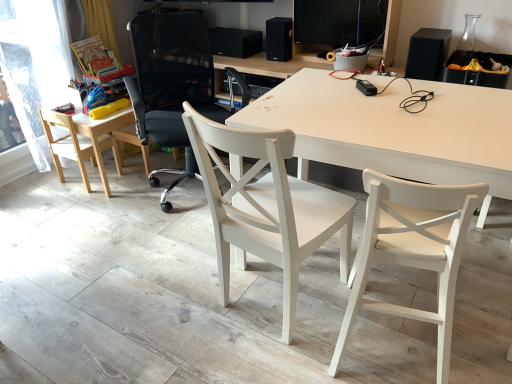
Question: Is white matte desk at center spatially inside black matte speaker at upper center, which ranks as the 2th speaker in right-to-left order, or outside of it?

Choices:
 (A) inside
 (B) outside

Answer: (B)

Question: Considering the relative positions of white matte desk at center and black matte speaker at upper center, arranged as the second speaker when viewed from the left, in the image provided, is white matte desk at center to the left or to the right of black matte speaker at upper center, arranged as the second speaker when viewed from the left,?

Choices:
 (A) left
 (B) right

Answer: (B)

Question: Estimate the real-world distances between objects in this image. Which object is closer to the transparent plastic window screen at left?

Choices:
 (A) light wood chair at left, arranged as the 1th chair when viewed from the left
 (B) white wood chair at center, acting as the 3th chair starting from the left
 (C) black matte speaker at upper right, the third speaker positioned from the left
 (D) white matte chair at center, placed as the 4th chair when sorted from left to right
 (E) black matte speaker at upper center, marked as the 3th speaker in a right-to-left arrangement

Answer: (A)

Question: Which object is the closest to the white wood chair at center, acting as the 3th chair starting from the left?

Choices:
 (A) black mesh office chair at center, acting as the second chair starting from the left
 (B) transparent plastic window screen at left
 (C) black matte speaker at upper right, which is the third speaker in back-to-front order
 (D) light wood chair at left, arranged as the 1th chair when viewed from the left
 (E) white matte desk at center

Answer: (E)